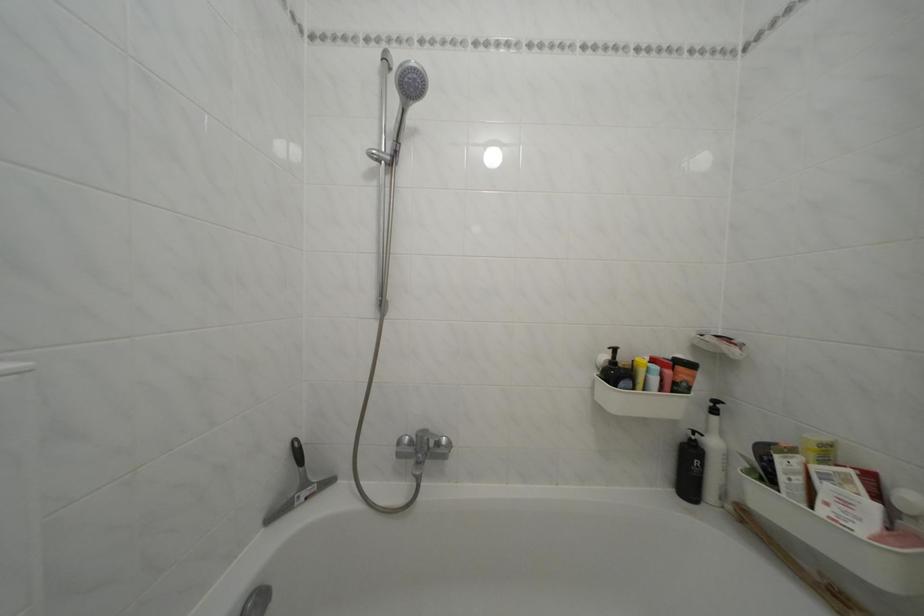
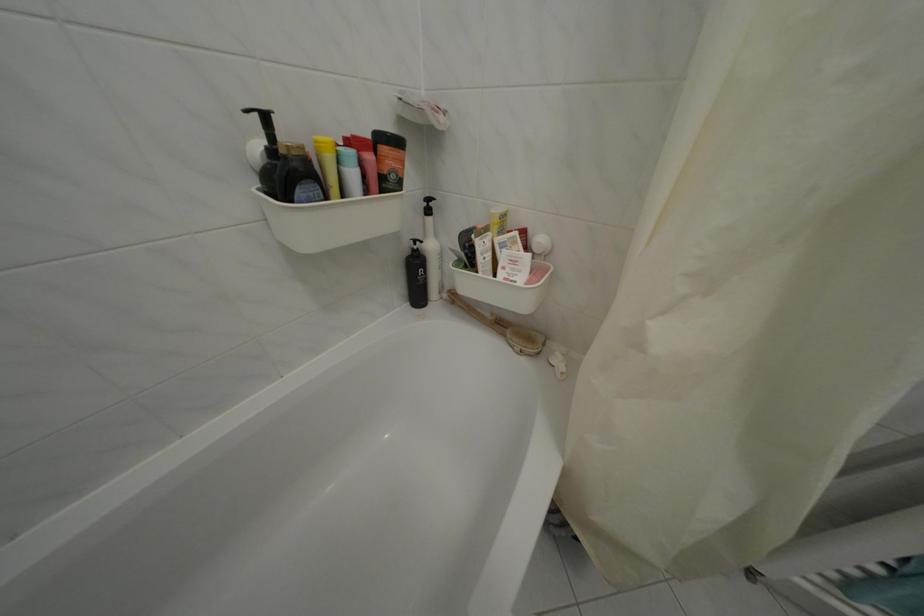
Locate, in the second image, the point that corresponds to point (615, 371) in the first image.

(274, 166)